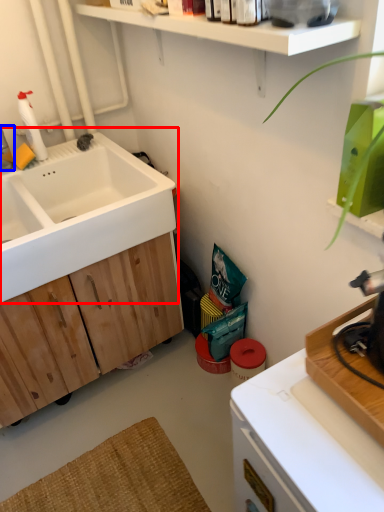
Question: Which of the following is the farthest to the observer, sink (highlighted by a red box) or faucet (highlighted by a blue box)?

Choices:
 (A) sink
 (B) faucet

Answer: (B)